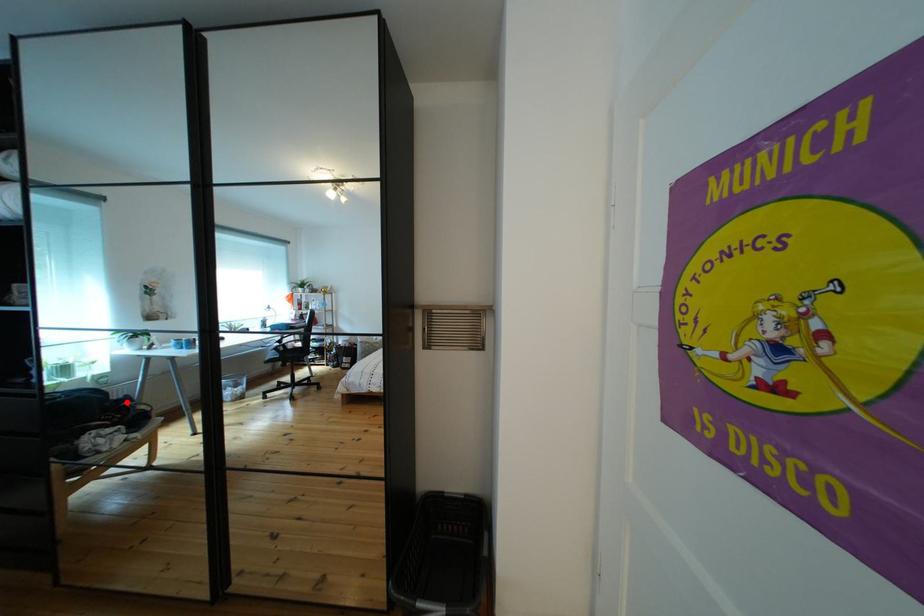
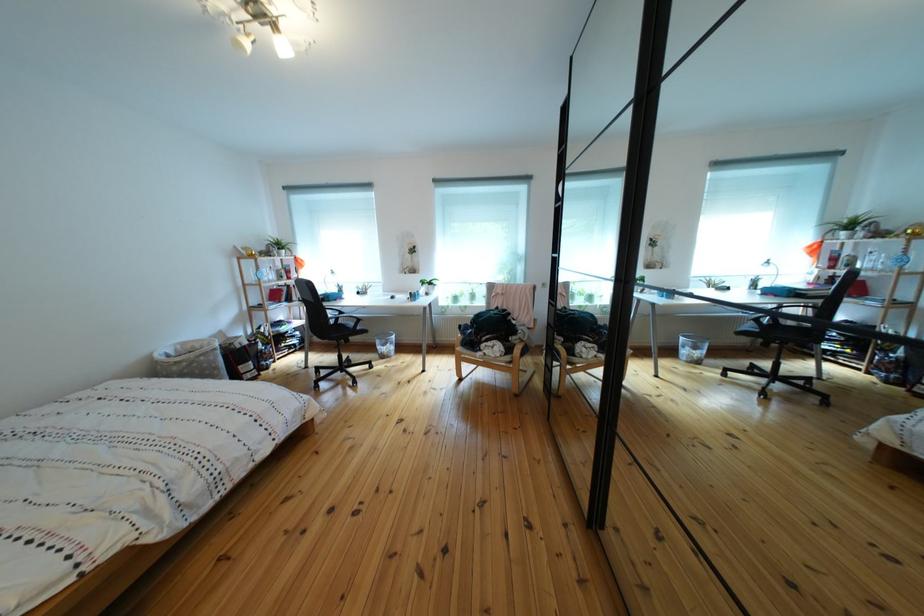
Where in the second image is the point corresponding to the highlighted location from the first image?

(613, 329)